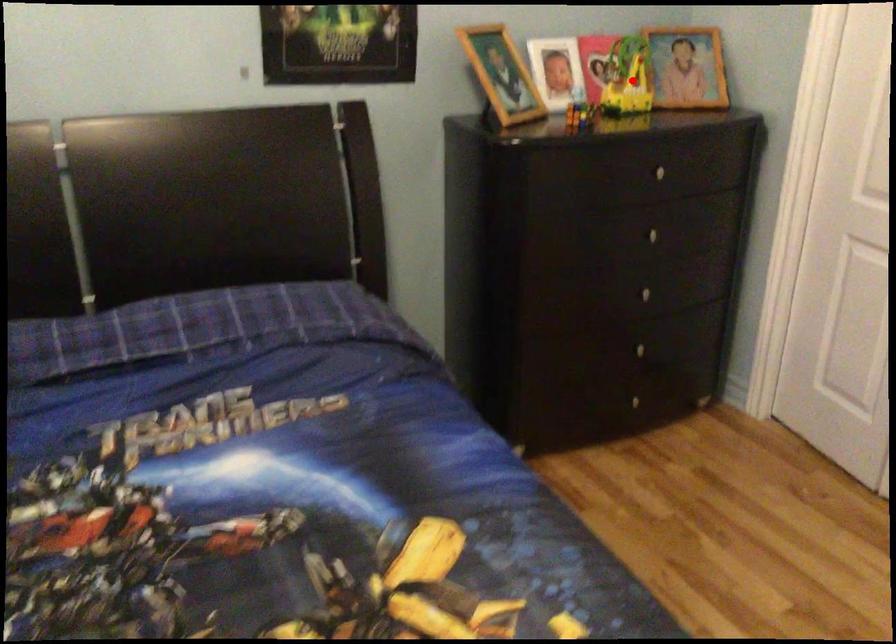
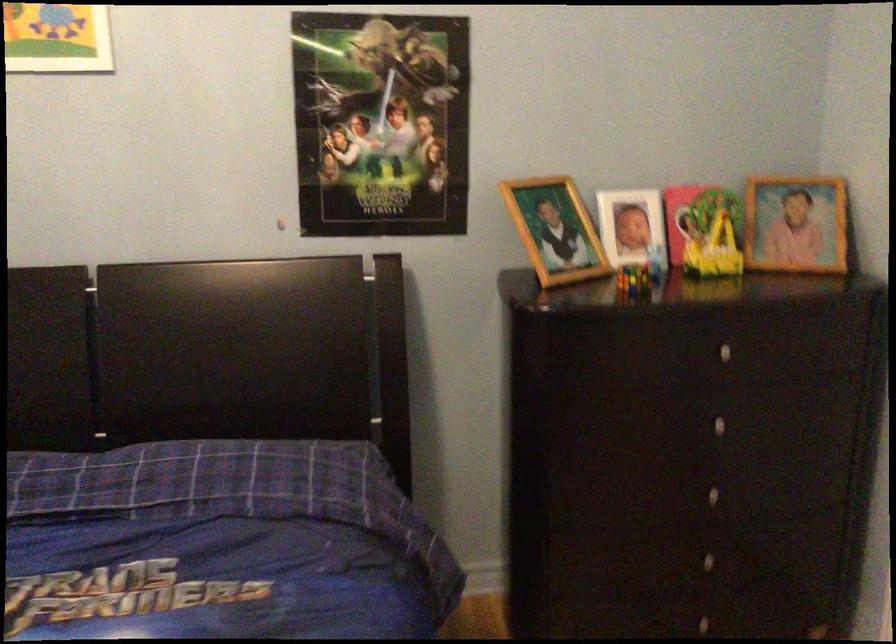
Question: I am providing you with two images of the same scene from different viewpoints. Given a red point in image1, look at the same physical point in image2. Is it:

Choices:
 (A) Closer to the viewpoint
 (B) Farther from the viewpoint

Answer: (A)